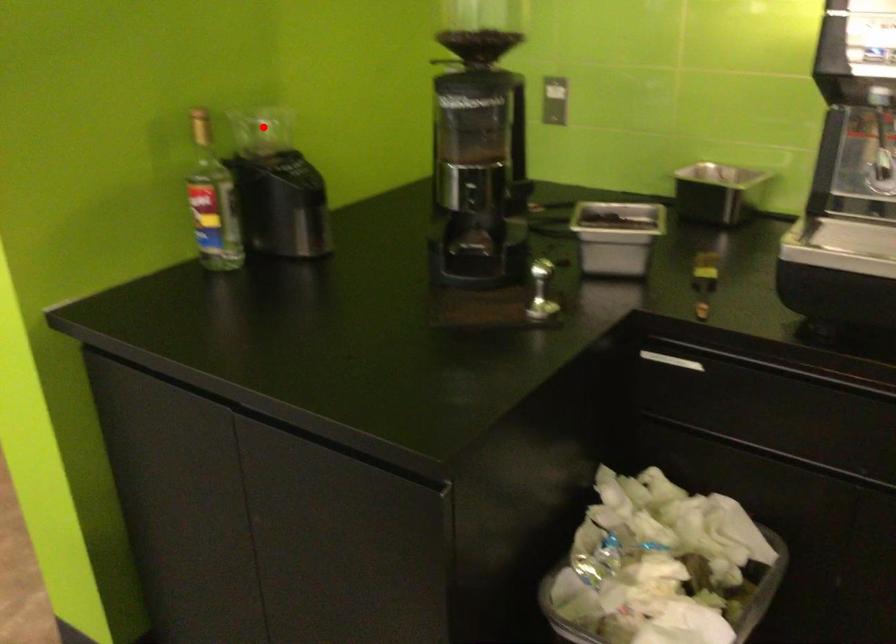
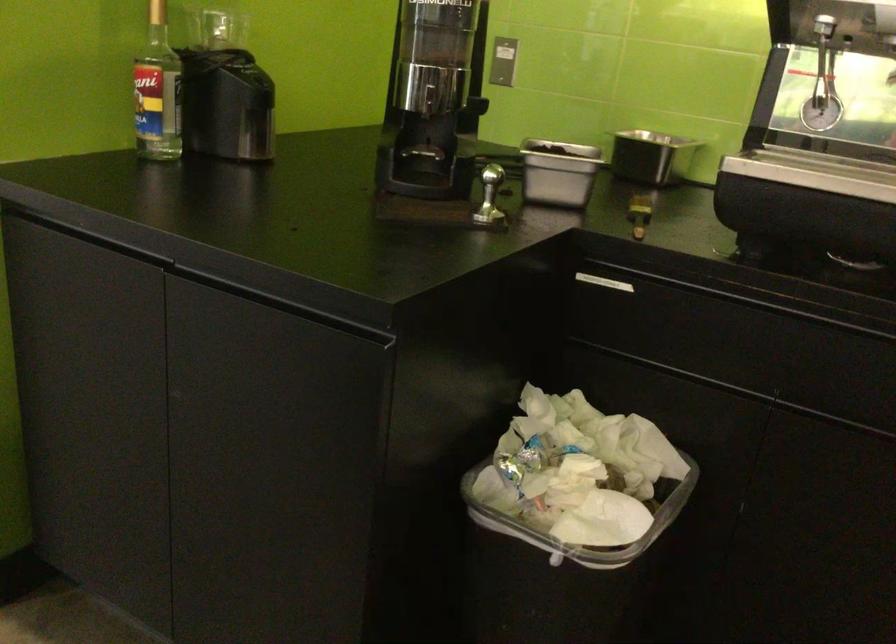
Question: I am providing you with two images of the same scene from different viewpoints. A red point is marked on the first image. At the location where the point appears in image 1, is it still visible in image 2?

Choices:
 (A) Yes
 (B) No

Answer: (A)